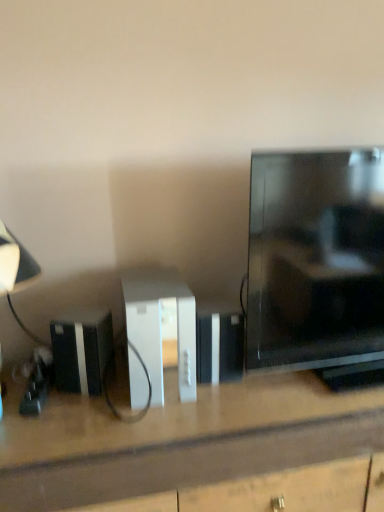
This screenshot has height=512, width=384. I want to click on free space between matte black lampshade at left and black plastic speaker at lower left, so click(71, 410).